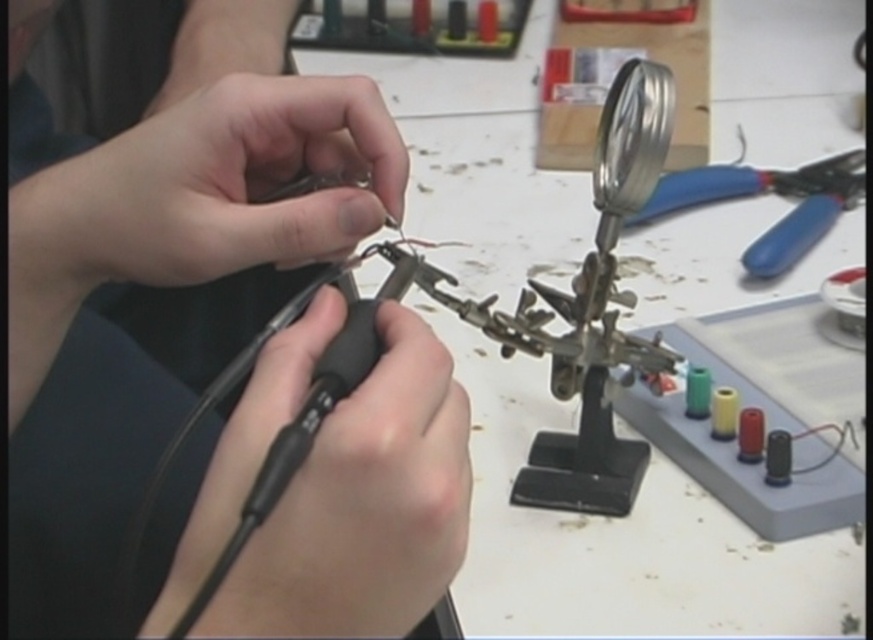
Between black rubberized pliers at center and matte black tool at center, which one has more height?

With more height is black rubberized pliers at center.

This screenshot has height=640, width=873. What do you see at coordinates (149, 289) in the screenshot?
I see `black rubberized pliers at center` at bounding box center [149, 289].

Describe the element at coordinates (149, 289) in the screenshot. This screenshot has width=873, height=640. I see `black rubberized pliers at center` at that location.

Where is `black rubberized pliers at center`? This screenshot has width=873, height=640. black rubberized pliers at center is located at coordinates (149, 289).

Between black rubberized pliers at center and blue plastic pliers at upper right, which one is positioned lower?

black rubberized pliers at center

Is black rubberized pliers at center thinner than blue plastic pliers at upper right?

No.

Does point (432, 572) come behind point (770, 179)?

No.

The height and width of the screenshot is (640, 873). What are the coordinates of `black rubberized pliers at center` in the screenshot? It's located at (149, 289).

Between black rubberized grip at center and blue plastic pliers at upper right, which one is positioned higher?

blue plastic pliers at upper right is above.

Can you confirm if black rubberized grip at center is smaller than blue plastic pliers at upper right?

Indeed, black rubberized grip at center has a smaller size compared to blue plastic pliers at upper right.

Is point (267, 584) positioned in front of point (858, 192)?

Yes, it is.

Locate an element on the screen. The height and width of the screenshot is (640, 873). black rubberized grip at center is located at coordinates (337, 492).